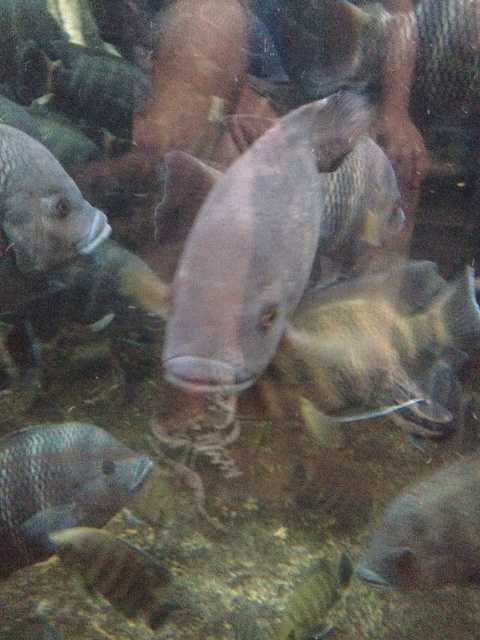
You are an underwater photographer aiming to capture a photo of both the shiny silver fish at lower left and the shiny silver fish at center. Which fish is located to the left of the other?

The shiny silver fish at lower left is positioned on the left side of the shiny silver fish at center.

You are an underwater photographer aiming to capture a closeup of the fish near the two points marked in the scene. Which point, point [398,545] or point [280,632], is better for focusing your camera to ensure the fish in the foreground is sharp?

Point [398,545] is closer to the camera than point [280,632], so focusing on point [398,545] will ensure the fish in the foreground is sharp.

You are an underwater photographer trying to capture a closeup of the shiny silver fish at lower left and the shiny silver fish at center. Since you want to focus on the bigger fish, which one should you aim your camera at?

The shiny silver fish at lower left is bigger than the shiny silver fish at center, so you should aim your camera at the shiny silver fish at lower left to capture a closeup of the bigger fish.